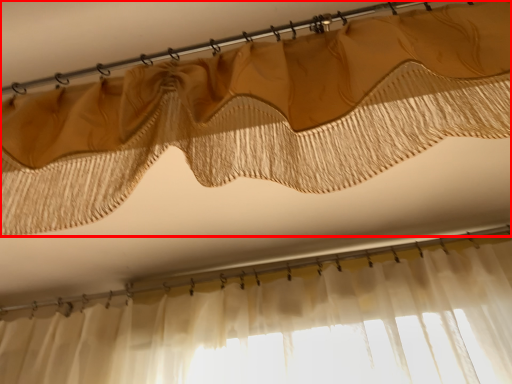
Question: From the image's perspective, where is curtain (annotated by the red box) located in relation to clothesline in the image?

Choices:
 (A) above
 (B) below

Answer: (B)